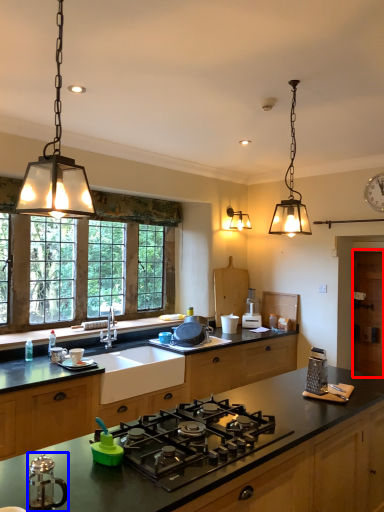
Question: Which of the following is the farthest to the observer, cabinetry (highlighted by a red box) or kitchen appliance (highlighted by a blue box)?

Choices:
 (A) cabinetry
 (B) kitchen appliance

Answer: (A)